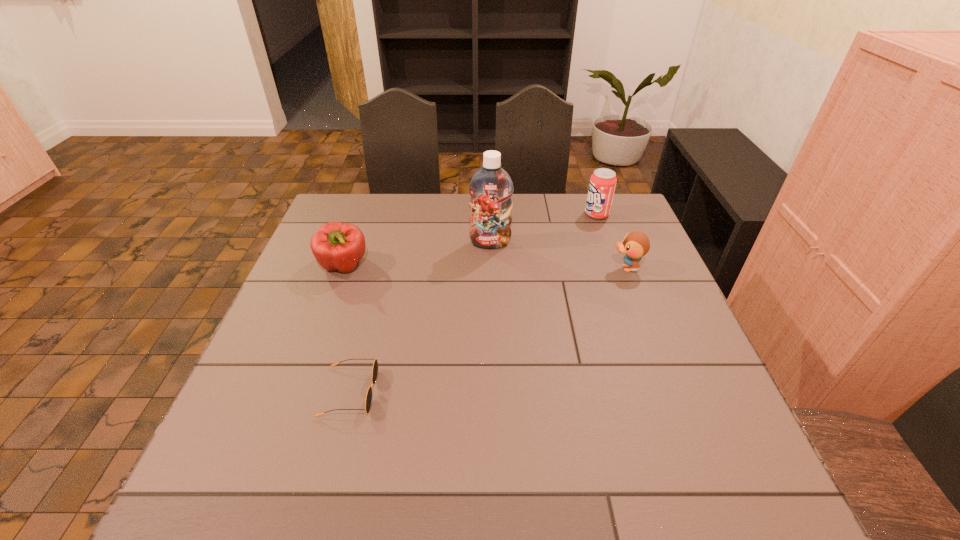
The width and height of the screenshot is (960, 540). In order to click on shampoo in this screenshot , I will do `click(491, 188)`.

This screenshot has width=960, height=540. Find the location of `the second farthest object`. the second farthest object is located at coordinates (491, 188).

This screenshot has height=540, width=960. Find the location of `the farthest object`. the farthest object is located at coordinates coord(603,181).

Image resolution: width=960 pixels, height=540 pixels. I want to click on bell pepper, so click(x=338, y=246).

Where is `duck`? Image resolution: width=960 pixels, height=540 pixels. duck is located at coordinates (636, 244).

Find the location of a particular element. This screenshot has height=540, width=960. the shortest object is located at coordinates click(x=375, y=366).

You are a GUI agent. You are given a task and a screenshot of the screen. Output one action in this format:
    pyautogui.click(x=<x>, y=<y>)
    Task: Click on the nearest object
    The width and height of the screenshot is (960, 540).
    Given the screenshot: What is the action you would take?
    pyautogui.click(x=375, y=366)

I want to click on vacant space situated 0.360m on the front label of the tallest object, so click(x=493, y=345).

What are the coordinates of `free space located 0.290m on the surface of the soda can` in the screenshot? It's located at tap(495, 214).

Find the location of a particular element. The image size is (960, 540). blank space located on the surface of the soda can is located at coordinates (523, 214).